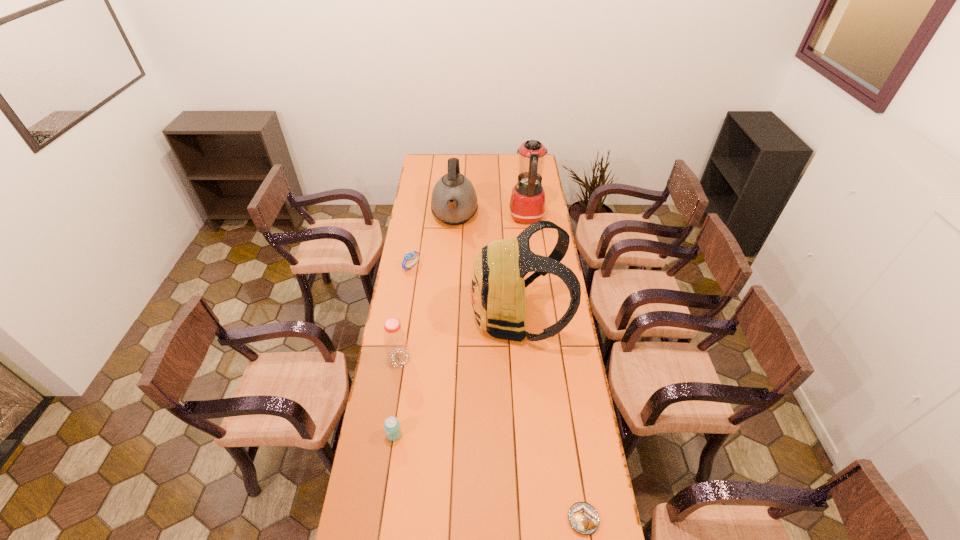
Select which object appears as the third closest to the watch. Please provide its 2D coordinates. Your answer should be formatted as a tuple, i.e. [(x, y)], where the tuple contains the x and y coordinates of a point satisfying the conditions above.

[(395, 339)]

Image resolution: width=960 pixels, height=540 pixels. I want to click on object that is the fifth closest one to the kettle, so click(392, 427).

The height and width of the screenshot is (540, 960). Find the location of `vacant area in the image that satisfies the following two spatial constraints: 1. on the controls of the nearest object; 2. on the left side of the food processor`. vacant area in the image that satisfies the following two spatial constraints: 1. on the controls of the nearest object; 2. on the left side of the food processor is located at coordinates (564, 519).